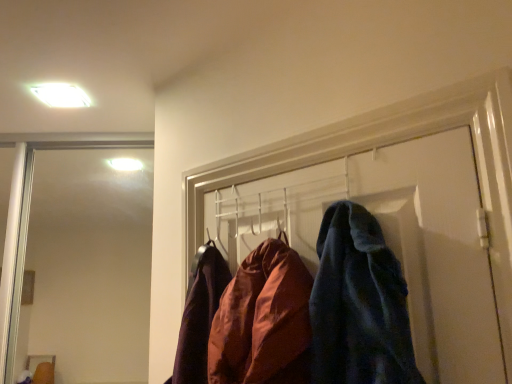
The width and height of the screenshot is (512, 384). Describe the element at coordinates (61, 95) in the screenshot. I see `white glossy light fixture at upper left` at that location.

The width and height of the screenshot is (512, 384). Find the location of `white glossy light fixture at upper left`. white glossy light fixture at upper left is located at coordinates (61, 95).

What is the approximate width of velvety blue coat at center?

8.26 inches.

Where is `velvety blue coat at center`? The width and height of the screenshot is (512, 384). velvety blue coat at center is located at coordinates (393, 240).

Image resolution: width=512 pixels, height=384 pixels. What do you see at coordinates (393, 240) in the screenshot? I see `velvety blue coat at center` at bounding box center [393, 240].

What are the coordinates of `white glossy light fixture at upper left` in the screenshot? It's located at (61, 95).

Looking at this image, which is more to the left, velvety blue coat at center or white glossy light fixture at upper left?

Positioned to the left is white glossy light fixture at upper left.

Which object is closer to the camera, velvety blue coat at center or white glossy light fixture at upper left?

velvety blue coat at center.

Is point (352, 162) less distant than point (66, 91)?

Yes, point (352, 162) is in front of point (66, 91).

From the image's perspective, which is above, velvety blue coat at center or white glossy light fixture at upper left?

From the image's view, white glossy light fixture at upper left is above.

From a real-world perspective, is velvety blue coat at center positioned under white glossy light fixture at upper left based on gravity?

Indeed, from a real-world perspective, velvety blue coat at center is positioned beneath white glossy light fixture at upper left.

Is velvety blue coat at center wider or thinner than white glossy light fixture at upper left?

velvety blue coat at center is wider than white glossy light fixture at upper left.

Is velvety blue coat at center taller or shorter than white glossy light fixture at upper left?

Considering their sizes, velvety blue coat at center has more height than white glossy light fixture at upper left.

Which of these two, velvety blue coat at center or white glossy light fixture at upper left, is bigger?

velvety blue coat at center is bigger.

Is velvety blue coat at center not inside white glossy light fixture at upper left?

Indeed, velvety blue coat at center is completely outside white glossy light fixture at upper left.

Would you consider velvety blue coat at center to be distant from white glossy light fixture at upper left?

Yes, velvety blue coat at center is far from white glossy light fixture at upper left.

Is velvety blue coat at center turned away from white glossy light fixture at upper left?

No, velvety blue coat at center's orientation is not away from white glossy light fixture at upper left.

How different are the orientations of velvety blue coat at center and white glossy light fixture at upper left in degrees?

44.9 degrees separate the facing orientations of velvety blue coat at center and white glossy light fixture at upper left.

Where is `door below the white glossy light fixture at upper left (from a real-world perspective)`? The height and width of the screenshot is (384, 512). door below the white glossy light fixture at upper left (from a real-world perspective) is located at coordinates (393, 240).

Would you say white glossy light fixture at upper left is to the left or to the right of velvety blue coat at center in the picture?

Clearly, white glossy light fixture at upper left is on the left of velvety blue coat at center in the image.

Based on the photo, considering their positions, is white glossy light fixture at upper left located in front of or behind velvety blue coat at center?

white glossy light fixture at upper left is behind velvety blue coat at center.

Is point (61, 107) in front of point (460, 285)?

No, (61, 107) is further to viewer.

From the image's perspective, between white glossy light fixture at upper left and velvety blue coat at center, who is located below?

velvety blue coat at center is shown below in the image.

Consider the image. From a real-world perspective, is white glossy light fixture at upper left physically located above or below velvety blue coat at center?

white glossy light fixture at upper left is above velvety blue coat at center.

Considering the relative sizes of white glossy light fixture at upper left and velvety blue coat at center in the image provided, is white glossy light fixture at upper left wider than velvety blue coat at center?

No, white glossy light fixture at upper left is not wider than velvety blue coat at center.

Is white glossy light fixture at upper left shorter than velvety blue coat at center?

Correct, white glossy light fixture at upper left is not as tall as velvety blue coat at center.

Based on their sizes in the image, would you say white glossy light fixture at upper left is bigger or smaller than velvety blue coat at center?

Considering their sizes, white glossy light fixture at upper left takes up less space than velvety blue coat at center.

Which is correct: white glossy light fixture at upper left is inside velvety blue coat at center, or outside of it?

white glossy light fixture at upper left cannot be found inside velvety blue coat at center.

Is white glossy light fixture at upper left placed right next to velvety blue coat at center?

white glossy light fixture at upper left and velvety blue coat at center are clearly separated.

Is white glossy light fixture at upper left looking in the opposite direction of velvety blue coat at center?

white glossy light fixture at upper left does not have its back to velvety blue coat at center.

What's the angular difference between white glossy light fixture at upper left and velvety blue coat at center's facing directions?

44.9 degrees separate the facing orientations of white glossy light fixture at upper left and velvety blue coat at center.

The width and height of the screenshot is (512, 384). Identify the location of door that appears on the right of white glossy light fixture at upper left. (393, 240).

Locate an element on the screen. The image size is (512, 384). light fixture behind the velvety blue coat at center is located at coordinates (61, 95).

The height and width of the screenshot is (384, 512). I want to click on door that appears on the right of white glossy light fixture at upper left, so click(393, 240).